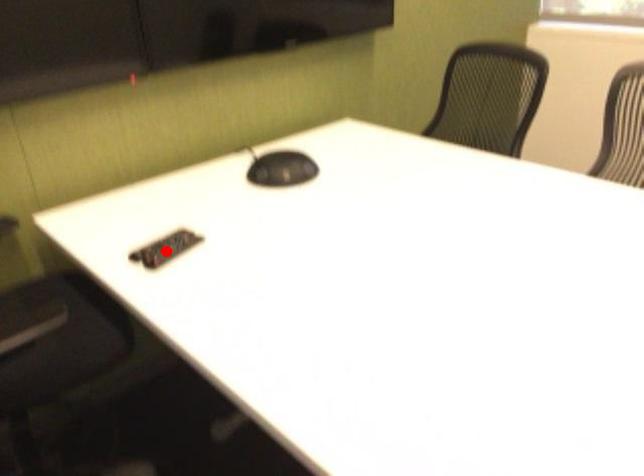
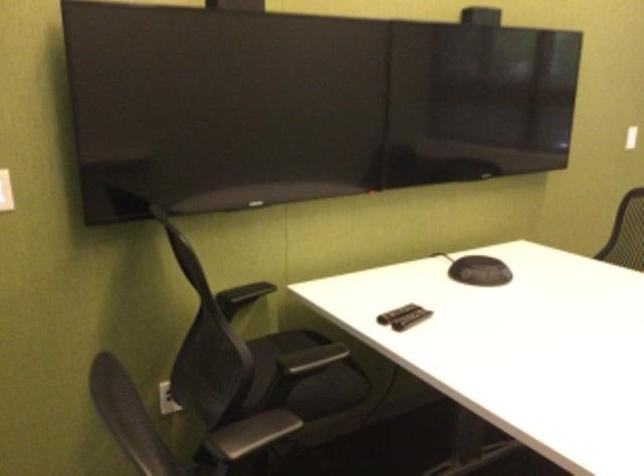
Question: I am providing you with two images of the same scene from different viewpoints. A red point is marked on the first image. At the location where the point appears in image 1, is it still visible in image 2?

Choices:
 (A) Yes
 (B) No

Answer: (A)